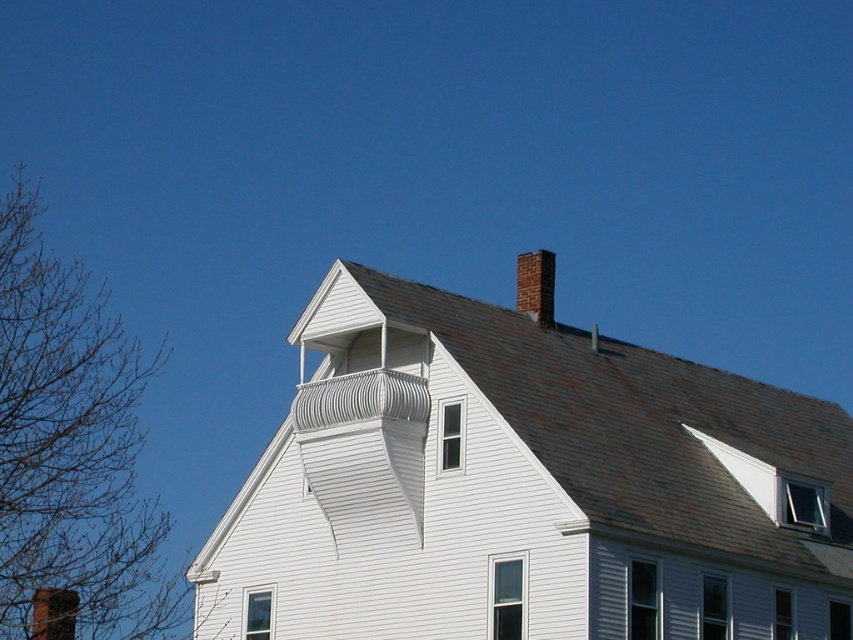
Is bare branches at left to the right of brick chimney at upper right from the viewer's perspective?

In fact, bare branches at left is to the left of brick chimney at upper right.

Who is lower down, bare branches at left or brick chimney at upper right?

bare branches at left is below.

Who is more forward, (71,531) or (538,314)?

Positioned in front is point (538,314).

You are a GUI agent. You are given a task and a screenshot of the screen. Output one action in this format:
    pyautogui.click(x=<x>, y=<y>)
    Task: Click on the bare branches at left
    The image size is (853, 640).
    Given the screenshot: What is the action you would take?
    pyautogui.click(x=73, y=445)

Can you confirm if bare branches at left is thinner than brown brick chimney at upper center?

Incorrect, bare branches at left's width is not less than brown brick chimney at upper center's.

Is bare branches at left positioned behind brown brick chimney at upper center?

Yes, bare branches at left is further from the viewer.

What are the coordinates of `bare branches at left` in the screenshot? It's located at (73, 445).

This screenshot has height=640, width=853. Find the location of `bare branches at left`. bare branches at left is located at coordinates (73, 445).

Can you confirm if brick chimney at upper right is positioned to the left of brown brick chimney at upper center?

Incorrect, brick chimney at upper right is not on the left side of brown brick chimney at upper center.

Where is `brick chimney at upper right`? Image resolution: width=853 pixels, height=640 pixels. brick chimney at upper right is located at coordinates (537, 285).